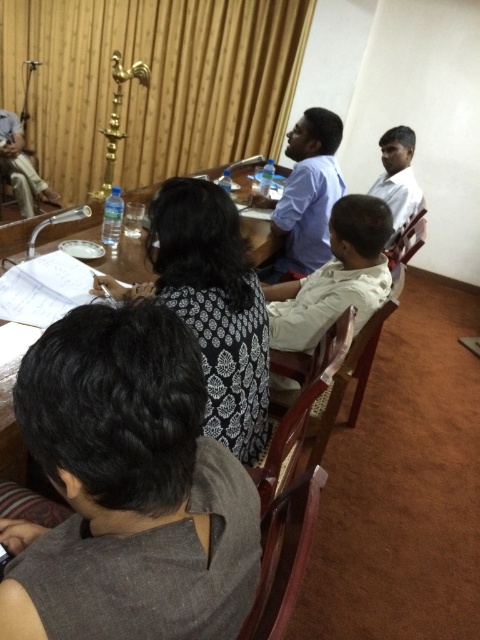
Who is lower down, wooden table at center or blue shirt at center?

wooden table at center is lower down.

Can you confirm if wooden table at center is shorter than blue shirt at center?

Indeed, wooden table at center has a lesser height compared to blue shirt at center.

Is point (160, 209) less distant than point (320, 122)?

Yes, point (160, 209) is closer to viewer.

Find the location of a particular element. The width and height of the screenshot is (480, 640). wooden table at center is located at coordinates (216, 307).

Is wooden table at center thinner than white cotton shirt at center?

No, wooden table at center is not thinner than white cotton shirt at center.

How much distance is there between wooden table at center and white cotton shirt at center?

20.17 inches

Locate an element on the screen. Image resolution: width=480 pixels, height=640 pixels. wooden table at center is located at coordinates (216, 307).

Identify the location of wooden table at center. Image resolution: width=480 pixels, height=640 pixels. (216, 307).

Is point (406, 221) positioned in front of point (26, 160)?

Yes, it is in front of point (26, 160).

The width and height of the screenshot is (480, 640). Find the location of `white matte shirt at upper right`. white matte shirt at upper right is located at coordinates (397, 177).

What are the coordinates of `white matte shirt at upper right` in the screenshot? It's located at [x=397, y=177].